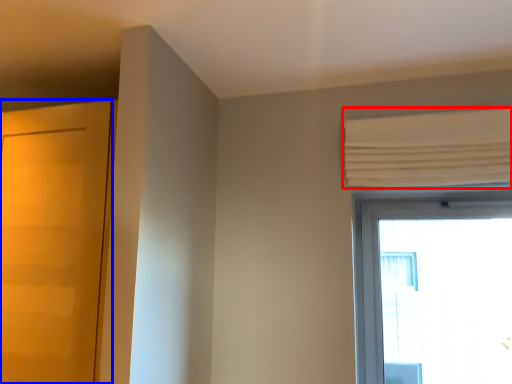
Question: Which of the following is the farthest to the observer, curtain (highlighted by a red box) or door (highlighted by a blue box)?

Choices:
 (A) curtain
 (B) door

Answer: (A)